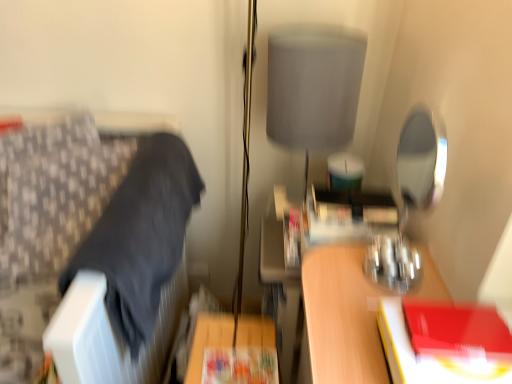
Question: From the image's perspective, is gray fabric lampshade at upper center located above or below matte paper paperback book at center, which is the second paperback book in top-to-bottom order?

Choices:
 (A) above
 (B) below

Answer: (A)

Question: Considering the positions of gray fabric lampshade at upper center and matte paper paperback book at center, positioned as the first paperback book in left-to-right order, in the image, is gray fabric lampshade at upper center wider or thinner than matte paper paperback book at center, positioned as the first paperback book in left-to-right order,?

Choices:
 (A) thin
 (B) wide

Answer: (B)

Question: Which is nearer to the red matte book at right, the 1th paperback book from the top?

Choices:
 (A) matte paper paperback book at center, which is the second paperback book in top-to-bottom order
 (B) patterned fabric cushion at left
 (C) gray fabric lampshade at upper center

Answer: (A)

Question: Which object is positioned closest to the patterned fabric cushion at left?

Choices:
 (A) gray fabric lampshade at upper center
 (B) matte paper paperback book at center, positioned as the first paperback book in left-to-right order
 (C) red matte book at right, the 2th paperback book viewed from the left

Answer: (B)